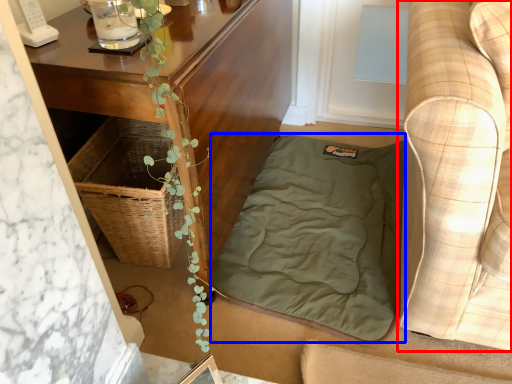
Question: Which object appears closest to the camera in this image, studio couch (highlighted by a red box) or blanket (highlighted by a blue box)?

Choices:
 (A) studio couch
 (B) blanket

Answer: (A)